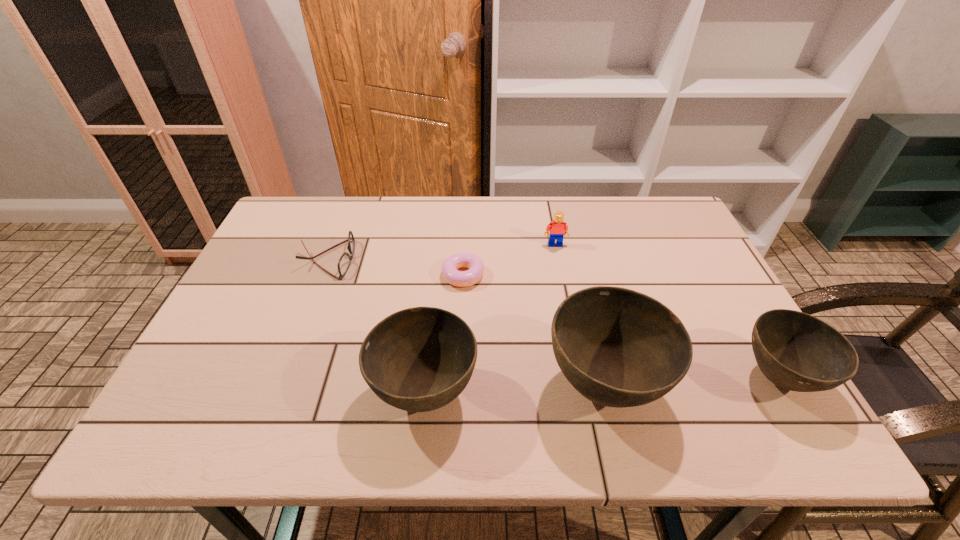
Image resolution: width=960 pixels, height=540 pixels. In the image, there is a desktop. Find the location of `vacant space at the near edge`. vacant space at the near edge is located at coordinates (525, 400).

At what (x,y) coordinates should I click in order to perform the action: click on vacant region at the left edge of the desktop. Please return your answer as a coordinate pair (x, y). This screenshot has width=960, height=540. Looking at the image, I should click on (270, 291).

In the image, there is a desktop. Where is `free region at the right edge`? free region at the right edge is located at coordinates pyautogui.click(x=685, y=284).

Where is `vacant area at the far right corner`? Image resolution: width=960 pixels, height=540 pixels. vacant area at the far right corner is located at coordinates (692, 237).

Where is `blank region between the rightmost bowl and the second bowl from left to right`? blank region between the rightmost bowl and the second bowl from left to right is located at coordinates (691, 382).

Locate an element on the screen. free space that is in between the doughnut and the Lego is located at coordinates (509, 260).

Locate an element on the screen. vacant area that lies between the second bowl from right to left and the doughnut is located at coordinates (534, 330).

Image resolution: width=960 pixels, height=540 pixels. I want to click on free point between the shortest bowl and the second bowl from left to right, so click(691, 382).

Identify the location of object that is the nearest to the Lego. The height and width of the screenshot is (540, 960). (449, 268).

Identify which object is the second nearest to the doughnut. Please provide its 2D coordinates. Your answer should be formatted as a tuple, i.e. [(x, y)], where the tuple contains the x and y coordinates of a point satisfying the conditions above.

[(419, 359)]